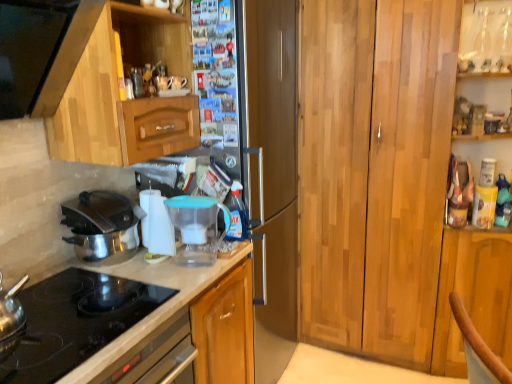
Question: Is white plastic water filter at center, the first appliance viewed from the left, smaller than polished stainless steel pot at left?

Choices:
 (A) yes
 (B) no

Answer: (A)

Question: Are white plastic water filter at center, which is counted as the 2th appliance, starting from the right, and polished stainless steel pot at left far apart?

Choices:
 (A) yes
 (B) no

Answer: (B)

Question: Considering the relative positions of white plastic water filter at center, which is counted as the 2th appliance, starting from the right, and polished stainless steel pot at left in the image provided, is white plastic water filter at center, which is counted as the 2th appliance, starting from the right, to the right of polished stainless steel pot at left from the viewer's perspective?

Choices:
 (A) no
 (B) yes

Answer: (B)

Question: Is white plastic water filter at center, the first appliance viewed from the left, aimed at polished stainless steel pot at left?

Choices:
 (A) yes
 (B) no

Answer: (B)

Question: Does white plastic water filter at center, which is counted as the 2th appliance, starting from the right, have a lesser width compared to polished stainless steel pot at left?

Choices:
 (A) no
 (B) yes

Answer: (B)

Question: Is point (231, 240) positioned closer to the camera than point (215, 317)?

Choices:
 (A) farther
 (B) closer

Answer: (A)

Question: Is transparent plastic bottle at center bigger or smaller than white glossy countertop at lower left?

Choices:
 (A) big
 (B) small

Answer: (B)

Question: Considering their positions, is transparent plastic bottle at center located in front of or behind white glossy countertop at lower left?

Choices:
 (A) behind
 (B) front

Answer: (A)

Question: From the image's perspective, relative to white glossy countertop at lower left, is transparent plastic bottle at center above or below?

Choices:
 (A) above
 (B) below

Answer: (A)

Question: Would you say wooden cabinet at right, which ranks as the first cabinetry in right-to-left order, is inside or outside polished stainless steel pot at left?

Choices:
 (A) inside
 (B) outside

Answer: (B)

Question: Based on their sizes in the image, would you say wooden cabinet at right, which ranks as the first cabinetry in right-to-left order, is bigger or smaller than polished stainless steel pot at left?

Choices:
 (A) small
 (B) big

Answer: (B)

Question: Considering the relative positions of wooden cabinet at right, which ranks as the first cabinetry in right-to-left order, and polished stainless steel pot at left in the image provided, is wooden cabinet at right, which ranks as the first cabinetry in right-to-left order, to the left or to the right of polished stainless steel pot at left?

Choices:
 (A) left
 (B) right

Answer: (B)

Question: Is wooden cabinet at right, the 2th cabinetry from the left, in front of or behind polished stainless steel pot at left in the image?

Choices:
 (A) behind
 (B) front

Answer: (A)

Question: Considering their positions, is polished stainless steel pot at left located in front of or behind wooden cabinet at right, which ranks as the first cabinetry in right-to-left order?

Choices:
 (A) front
 (B) behind

Answer: (A)

Question: Is point (98, 198) closer or farther from the camera than point (378, 79)?

Choices:
 (A) farther
 (B) closer

Answer: (B)